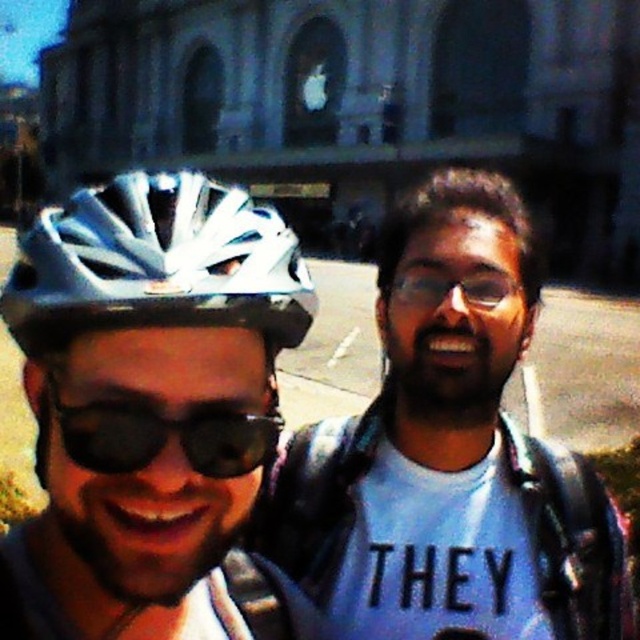
Does shiny silver helmet at left appear over black reflective sunglasses at center?

Indeed, shiny silver helmet at left is positioned over black reflective sunglasses at center.

Which is above, shiny silver helmet at left or black reflective sunglasses at center?

shiny silver helmet at left is above.

Who is more distant from viewer, (284, 241) or (83, 451)?

Positioned behind is point (284, 241).

Find the location of `shiny silver helmet at left`. shiny silver helmet at left is located at coordinates (156, 262).

Image resolution: width=640 pixels, height=640 pixels. What do you see at coordinates (449, 454) in the screenshot?
I see `matte black helmet at left` at bounding box center [449, 454].

Looking at this image, between matte black helmet at left and black reflective sunglasses at center, which one appears on the left side from the viewer's perspective?

From the viewer's perspective, black reflective sunglasses at center appears more on the left side.

The width and height of the screenshot is (640, 640). What are the coordinates of `matte black helmet at left` in the screenshot? It's located at (449, 454).

Where is `matte black helmet at left`? matte black helmet at left is located at coordinates (449, 454).

In the scene shown: Can you confirm if matte black helmet at left is thinner than shiny silver helmet at left?

Correct, matte black helmet at left's width is less than shiny silver helmet at left's.

Is point (134, 253) closer to viewer compared to point (8, 294)?

That is True.

Is point (83, 234) less distant than point (208, 202)?

That is True.

Find the location of a particular element. matte black helmet at left is located at coordinates click(x=449, y=454).